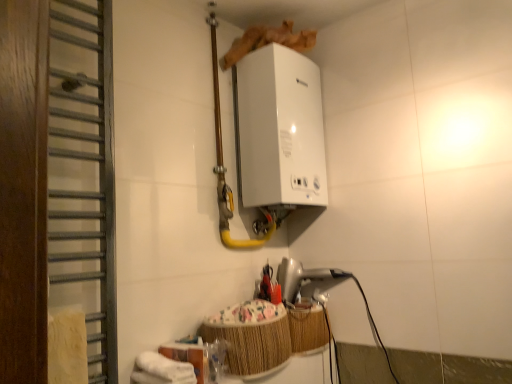
Locate an element on the screen. The width and height of the screenshot is (512, 384). white glossy boiler at upper center, which is the first appliance in top-to-bottom order is located at coordinates (279, 129).

What do you see at coordinates (279, 129) in the screenshot? This screenshot has height=384, width=512. I see `white glossy boiler at upper center, which is the first appliance in top-to-bottom order` at bounding box center [279, 129].

Describe the element at coordinates (251, 337) in the screenshot. This screenshot has height=384, width=512. I see `woven bamboo basket at lower center` at that location.

Identify the location of wooden towel rack at left. Image resolution: width=512 pixels, height=384 pixels. (83, 174).

Is wooden towel rack at left positioned with its back to woven bamboo basket at lower center?

wooden towel rack at left does not have its back to woven bamboo basket at lower center.

Between wooden towel rack at left and woven bamboo basket at lower center, which one has less height?

Standing shorter between the two is woven bamboo basket at lower center.

The image size is (512, 384). I want to click on door in front of the woven bamboo basket at lower center, so click(83, 174).

Is wooden towel rack at left inside the boundaries of woven bamboo basket at lower center, or outside?

The correct answer is: outside.

Is white glossy pipe at upper center directly adjacent to wooden towel rack at left?

white glossy pipe at upper center and wooden towel rack at left are clearly separated.

In the scene shown: From the image's perspective, which is above, white glossy pipe at upper center or wooden towel rack at left?

white glossy pipe at upper center, from the image's perspective.

Considering the sizes of objects white glossy pipe at upper center and wooden towel rack at left in the image provided, who is taller, white glossy pipe at upper center or wooden towel rack at left?

Standing taller between the two is wooden towel rack at left.

From a real-world perspective, is white glossy pipe at upper center on wooden towel rack at left?

Yes, from a real-world perspective, white glossy pipe at upper center is over wooden towel rack at left

Is white glossy boiler at upper center, the 2th appliance when ordered from bottom to top, oriented towards white glossy pipe at upper center?

Yes, white glossy boiler at upper center, the 2th appliance when ordered from bottom to top, is aimed at white glossy pipe at upper center.

From a real-world perspective, is white glossy boiler at upper center, the 2th appliance when ordered from bottom to top, under white glossy pipe at upper center?

Correct, in the physical world, white glossy boiler at upper center, the 2th appliance when ordered from bottom to top, is lower than white glossy pipe at upper center.

From the image's perspective, relative to white glossy pipe at upper center, is white glossy boiler at upper center, which is the first appliance in top-to-bottom order, above or below?

Based on their image positions, white glossy boiler at upper center, which is the first appliance in top-to-bottom order, is located beneath white glossy pipe at upper center.

Considering the relative sizes of white glossy boiler at upper center, which is the first appliance in top-to-bottom order, and white glossy pipe at upper center in the image provided, is white glossy boiler at upper center, which is the first appliance in top-to-bottom order, smaller than white glossy pipe at upper center?

Indeed, white glossy boiler at upper center, which is the first appliance in top-to-bottom order, has a smaller size compared to white glossy pipe at upper center.

What are the coordinates of `basket in front of the white glossy pipe at upper center` in the screenshot? It's located at (251, 337).

Is woven bamboo basket at lower center completely or partially outside of white glossy pipe at upper center?

Yes.

How different are the orientations of woven bamboo basket at lower center and white glossy pipe at upper center in degrees?

They differ by 3.13 degrees in their facing directions.

From the image's perspective, which is above, woven bamboo basket at lower center or white glossy pipe at upper center?

white glossy pipe at upper center is shown above in the image.

Which object is more forward, silver metallic hairdryer at lower center, which is the first appliance from bottom to top, or wooden towel rack at left?

wooden towel rack at left is closer to the camera.

Does silver metallic hairdryer at lower center, which is the first appliance from bottom to top, have a lesser width compared to wooden towel rack at left?

Incorrect, the width of silver metallic hairdryer at lower center, which is the first appliance from bottom to top, is not less than that of wooden towel rack at left.

From the picture: From the image's perspective, which one is positioned lower, silver metallic hairdryer at lower center, which appears as the 2th appliance when viewed from the top, or wooden towel rack at left?

silver metallic hairdryer at lower center, which appears as the 2th appliance when viewed from the top, is shown below in the image.

Considering the points (303, 275) and (54, 3), which point is in front, point (303, 275) or point (54, 3)?

The point (54, 3) is in front.

The width and height of the screenshot is (512, 384). I want to click on door above the silver metallic hairdryer at lower center, which appears as the 2th appliance when viewed from the top (from a real-world perspective), so click(83, 174).

Is wooden towel rack at left shorter than silver metallic hairdryer at lower center, which appears as the 2th appliance when viewed from the top?

No.

Is point (84, 142) closer or farther from the camera than point (301, 286)?

Point (84, 142) is positioned closer to the camera compared to point (301, 286).

Measure the distance from wooden towel rack at left to silver metallic hairdryer at lower center, which is the first appliance from bottom to top.

The distance of wooden towel rack at left from silver metallic hairdryer at lower center, which is the first appliance from bottom to top, is 33.04 inches.

Is the position of wooden towel rack at left more distant than that of white glossy boiler at upper center, which is the first appliance in top-to-bottom order?

That is False.

Based on their positions, is wooden towel rack at left located to the left or right of white glossy boiler at upper center, the 2th appliance when ordered from bottom to top?

wooden towel rack at left is to the left of white glossy boiler at upper center, the 2th appliance when ordered from bottom to top.

Is wooden towel rack at left located outside white glossy boiler at upper center, the 2th appliance when ordered from bottom to top?

wooden towel rack at left is positioned outside white glossy boiler at upper center, the 2th appliance when ordered from bottom to top.

Based on the photo, is wooden towel rack at left with white glossy boiler at upper center, which is the first appliance in top-to-bottom order?

No, wooden towel rack at left is not in contact with white glossy boiler at upper center, which is the first appliance in top-to-bottom order.

Locate an element on the screen. Image resolution: width=512 pixels, height=384 pixels. door above the woven bamboo basket at lower center (from a real-world perspective) is located at coordinates (83, 174).

At what (x,y) coordinates should I click in order to perform the action: click on door on the left of the white glossy pipe at upper center. Please return your answer as a coordinate pair (x, y). This screenshot has width=512, height=384. Looking at the image, I should click on (83, 174).

When comparing their distances from woven bamboo basket at lower center, does silver metallic hairdryer at lower center, which is the first appliance from bottom to top, or wooden towel rack at left seem further?

The object further to woven bamboo basket at lower center is wooden towel rack at left.

Which object lies nearer to the anchor point woven bamboo basket at lower center, silver metallic hairdryer at lower center, which is the first appliance from bottom to top, or white glossy pipe at upper center?

Among the two, silver metallic hairdryer at lower center, which is the first appliance from bottom to top, is located nearer to woven bamboo basket at lower center.

Looking at the image, which one is located further to white glossy boiler at upper center, the 2th appliance when ordered from bottom to top, white glossy pipe at upper center or woven bamboo basket at lower center?

woven bamboo basket at lower center lies further to white glossy boiler at upper center, the 2th appliance when ordered from bottom to top, than the other object.

When comparing their distances from wooden towel rack at left, does woven bamboo basket at lower center or silver metallic hairdryer at lower center, which is the first appliance from bottom to top, seem further?

The object further to wooden towel rack at left is silver metallic hairdryer at lower center, which is the first appliance from bottom to top.

Considering their positions, is white glossy pipe at upper center positioned further to silver metallic hairdryer at lower center, which appears as the 2th appliance when viewed from the top, than woven bamboo basket at lower center?

white glossy pipe at upper center lies further to silver metallic hairdryer at lower center, which appears as the 2th appliance when viewed from the top, than the other object.

From the image, which object appears to be farther from woven bamboo basket at lower center, wooden towel rack at left or silver metallic hairdryer at lower center, which is the first appliance from bottom to top?

wooden towel rack at left is further to woven bamboo basket at lower center.

From the image, which object appears to be nearer to white glossy pipe at upper center, silver metallic hairdryer at lower center, which appears as the 2th appliance when viewed from the top, or wooden towel rack at left?

silver metallic hairdryer at lower center, which appears as the 2th appliance when viewed from the top, is closer to white glossy pipe at upper center.

Which object lies nearer to the anchor point silver metallic hairdryer at lower center, which is the first appliance from bottom to top, white glossy pipe at upper center or white glossy boiler at upper center, the 2th appliance when ordered from bottom to top?

white glossy pipe at upper center lies closer to silver metallic hairdryer at lower center, which is the first appliance from bottom to top, than the other object.

Locate an element on the screen. appliance situated between wooden towel rack at left and silver metallic hairdryer at lower center, which is the first appliance from bottom to top, from left to right is located at coordinates (279, 129).

Identify the location of appliance between white glossy pipe at upper center and silver metallic hairdryer at lower center, which is the first appliance from bottom to top, in the up-down direction. This screenshot has height=384, width=512. (279, 129).

You are a GUI agent. You are given a task and a screenshot of the screen. Output one action in this format:
    pyautogui.click(x=<x>, y=<y>)
    Task: Click on the door that lies between white glossy boiler at upper center, which is the first appliance in top-to-bottom order, and woven bamboo basket at lower center from top to bottom
    
    Given the screenshot: What is the action you would take?
    pyautogui.click(x=83, y=174)

Where is `pipe between wooden towel rack at left and white glossy boiler at upper center, which is the first appliance in top-to-bottom order, in the horizontal direction`? pipe between wooden towel rack at left and white glossy boiler at upper center, which is the first appliance in top-to-bottom order, in the horizontal direction is located at coordinates (225, 168).